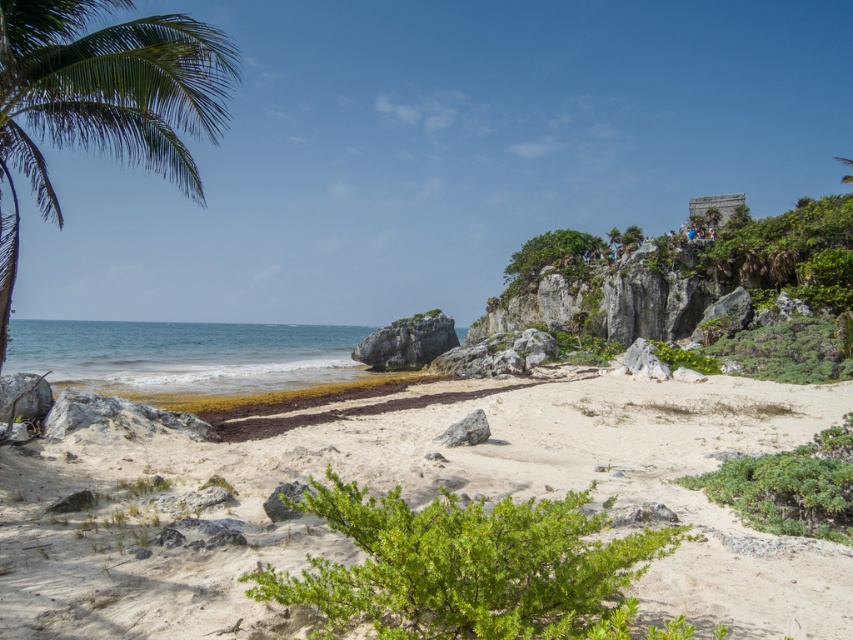
Question: Can you confirm if green leafy palm tree at left is positioned to the left of gray rough rock at center?

Choices:
 (A) yes
 (B) no

Answer: (A)

Question: Which point is closer to the camera?

Choices:
 (A) gray rough rock at center
 (B) green leafy palm tree at left
 (C) smooth gray rock at center

Answer: (A)

Question: Does smooth gray rock at center appear over gray rough rock at center?

Choices:
 (A) yes
 (B) no

Answer: (B)

Question: Is green leafy palm tree at left above smooth gray rock at center?

Choices:
 (A) no
 (B) yes

Answer: (B)

Question: Which of the following is the farthest from the observer?

Choices:
 (A) (274, 561)
 (B) (473, 438)
 (C) (0, 220)
 (D) (267, 509)

Answer: (B)

Question: Estimate the real-world distances between objects in this image. Which object is closer to the smooth gray rock at center?

Choices:
 (A) white sandy beach at center
 (B) green leafy palm tree at left
 (C) gray rough rock at center

Answer: (A)